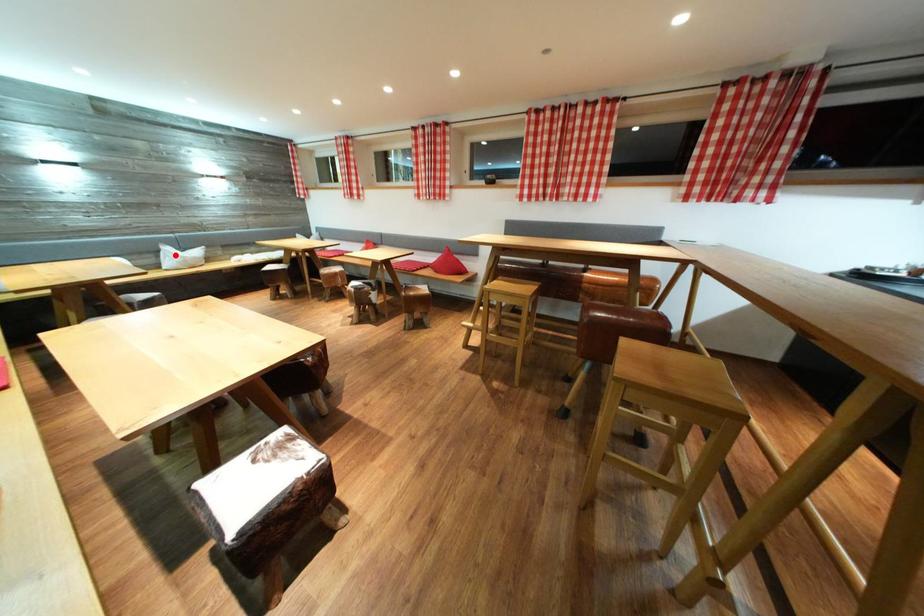
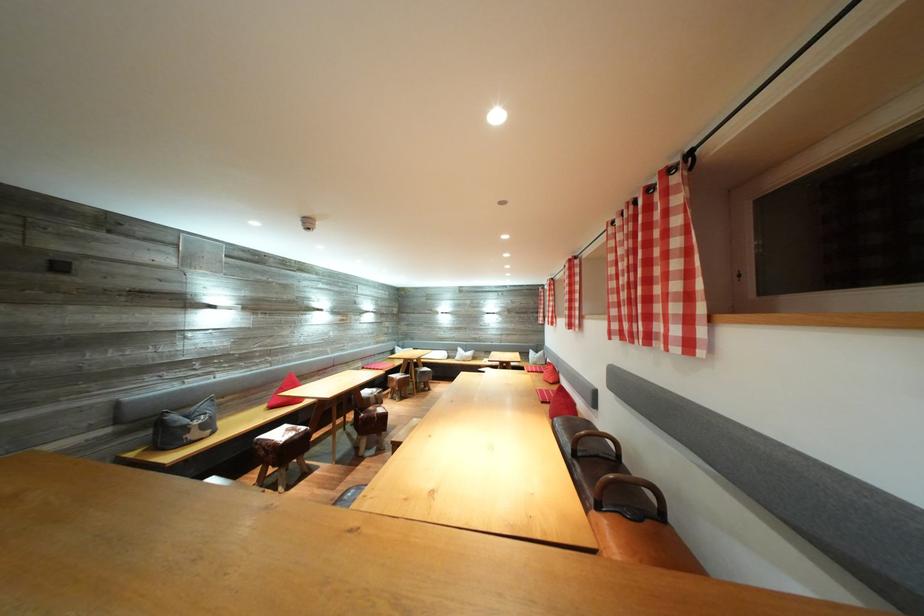
Find the pixel in the second image that matches the highlighted location in the first image.

(467, 355)